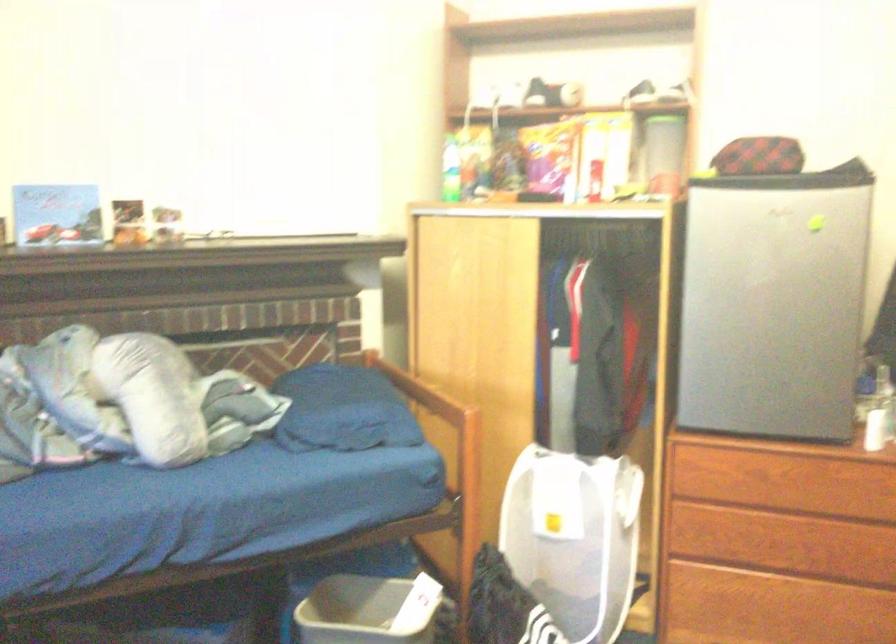
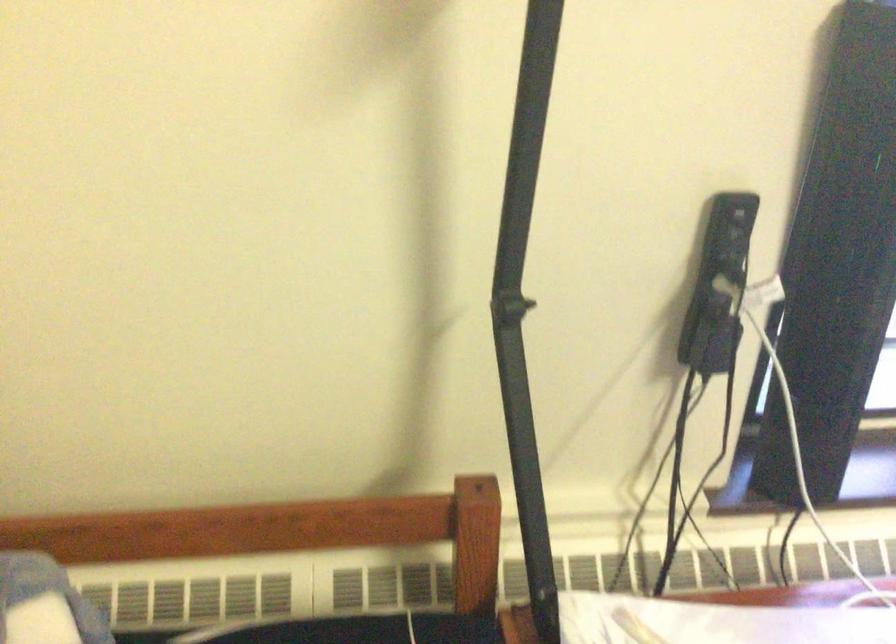
How did the camera likely rotate?

The camera's rotation is toward left-down.